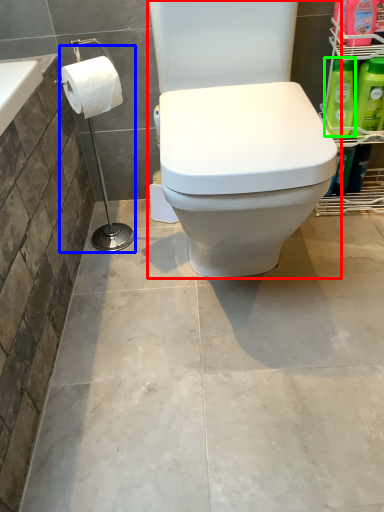
Question: Which is farther away from toilet (highlighted by a red box)? shower (highlighted by a blue box) or cleaning product (highlighted by a green box)?

Choices:
 (A) shower
 (B) cleaning product

Answer: (B)